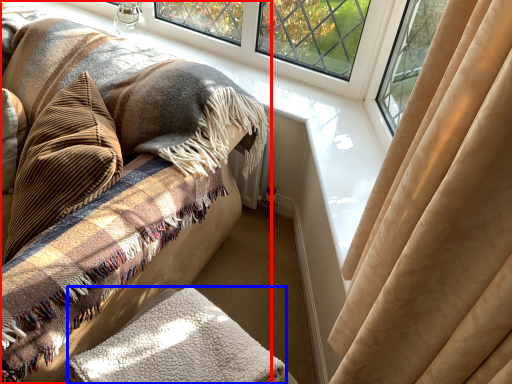
Question: Which point is closer to the camera, furniture (highlighted by a red box) or blanket (highlighted by a blue box)?

Choices:
 (A) furniture
 (B) blanket

Answer: (A)